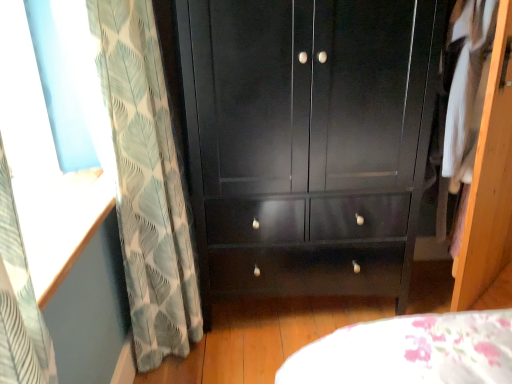
Question: From the image's perspective, does white fabric at right appear lower than glossy black cupboard at center?

Choices:
 (A) yes
 (B) no

Answer: (B)

Question: Could glossy black cupboard at center be considered to be inside white fabric at right?

Choices:
 (A) yes
 (B) no

Answer: (B)

Question: From a real-world perspective, is white fabric at right over glossy black cupboard at center?

Choices:
 (A) yes
 (B) no

Answer: (A)

Question: Are white fabric at right and glossy black cupboard at center beside each other?

Choices:
 (A) yes
 (B) no

Answer: (B)

Question: Does white fabric at right have a smaller size compared to glossy black cupboard at center?

Choices:
 (A) yes
 (B) no

Answer: (A)

Question: From a real-world perspective, is white fabric at right located beneath glossy black cupboard at center?

Choices:
 (A) no
 (B) yes

Answer: (A)

Question: Is green leaf-patterned curtain at left shorter than glossy black cupboard at center?

Choices:
 (A) yes
 (B) no

Answer: (B)

Question: Is green leaf-patterned curtain at left taller than glossy black cupboard at center?

Choices:
 (A) no
 (B) yes

Answer: (B)

Question: Considering the relative positions of green leaf-patterned curtain at left and glossy black cupboard at center in the image provided, is green leaf-patterned curtain at left to the left of glossy black cupboard at center from the viewer's perspective?

Choices:
 (A) no
 (B) yes

Answer: (B)

Question: Can you confirm if green leaf-patterned curtain at left is wider than glossy black cupboard at center?

Choices:
 (A) no
 (B) yes

Answer: (A)

Question: Is green leaf-patterned curtain at left further to camera compared to glossy black cupboard at center?

Choices:
 (A) yes
 (B) no

Answer: (B)

Question: Is green leaf-patterned curtain at left aimed at glossy black cupboard at center?

Choices:
 (A) yes
 (B) no

Answer: (A)

Question: Does white fabric at right have a larger size compared to green leaf-patterned curtain at left?

Choices:
 (A) yes
 (B) no

Answer: (B)